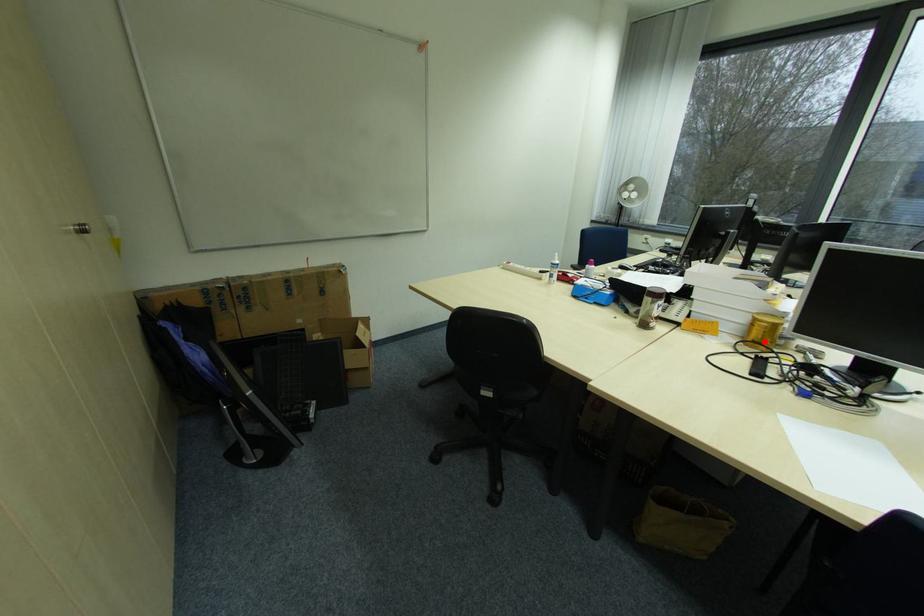
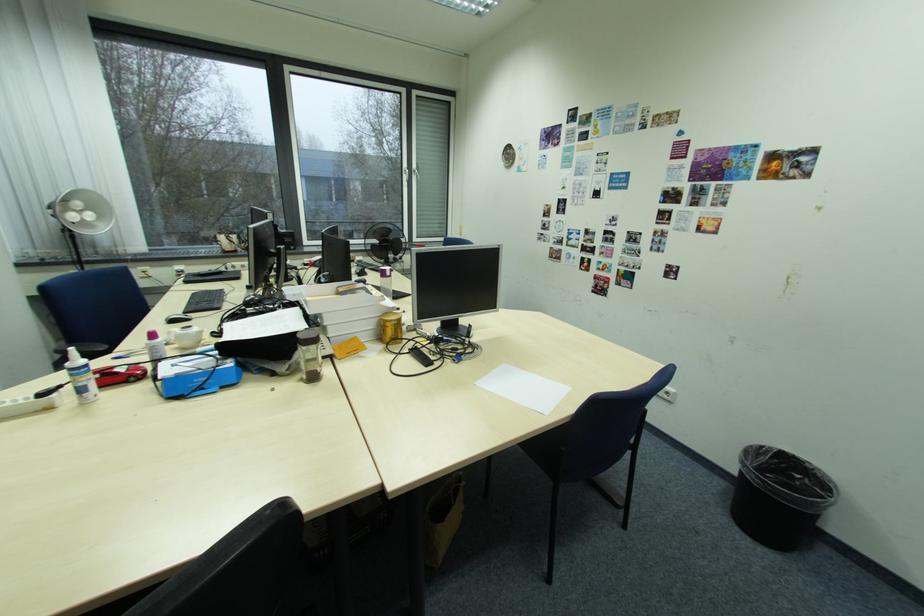
The point at the highlighted location is marked in the first image. Where is the corresponding point in the second image?

(400, 339)